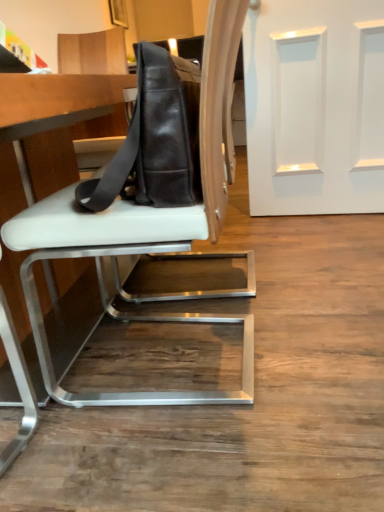
Where is `vacant space behind white leather chair at center`? This screenshot has height=512, width=384. vacant space behind white leather chair at center is located at coordinates (201, 286).